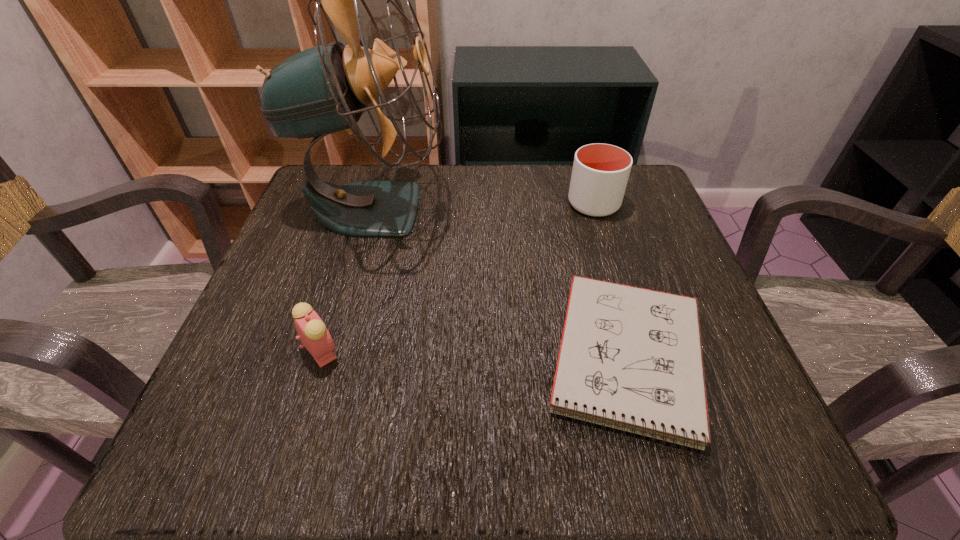
Image resolution: width=960 pixels, height=540 pixels. In order to click on the tallest object in this screenshot , I will do `click(324, 89)`.

The image size is (960, 540). I want to click on the third shortest object, so click(x=600, y=173).

Locate an element on the screen. the third tallest object is located at coordinates (314, 336).

I want to click on notepad, so click(630, 358).

This screenshot has width=960, height=540. Find the location of `vacant space located on the front-facing side of the fan for air flow`. vacant space located on the front-facing side of the fan for air flow is located at coordinates (501, 208).

I want to click on free region located 0.070m on the right of the third shortest object, so click(x=651, y=204).

Where is `vacant region located on the face of the alarm clock`? The image size is (960, 540). vacant region located on the face of the alarm clock is located at coordinates (504, 351).

The image size is (960, 540). Find the location of `vacant area situated 0.360m on the back of the notepad`. vacant area situated 0.360m on the back of the notepad is located at coordinates (577, 177).

Identify the location of fan located in the far edge section of the desktop. The height and width of the screenshot is (540, 960). (324, 89).

The width and height of the screenshot is (960, 540). In order to click on cup present at the far edge in this screenshot , I will do `click(600, 173)`.